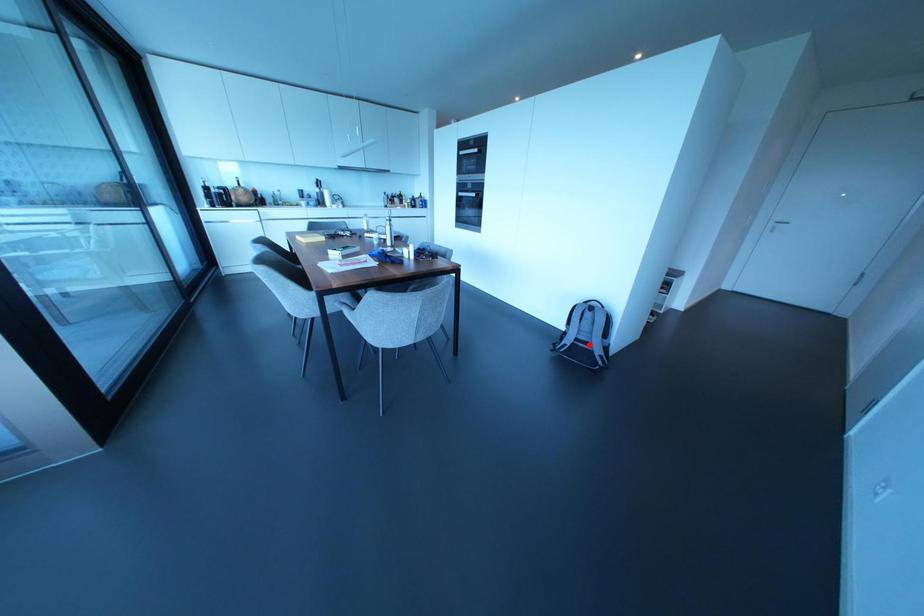
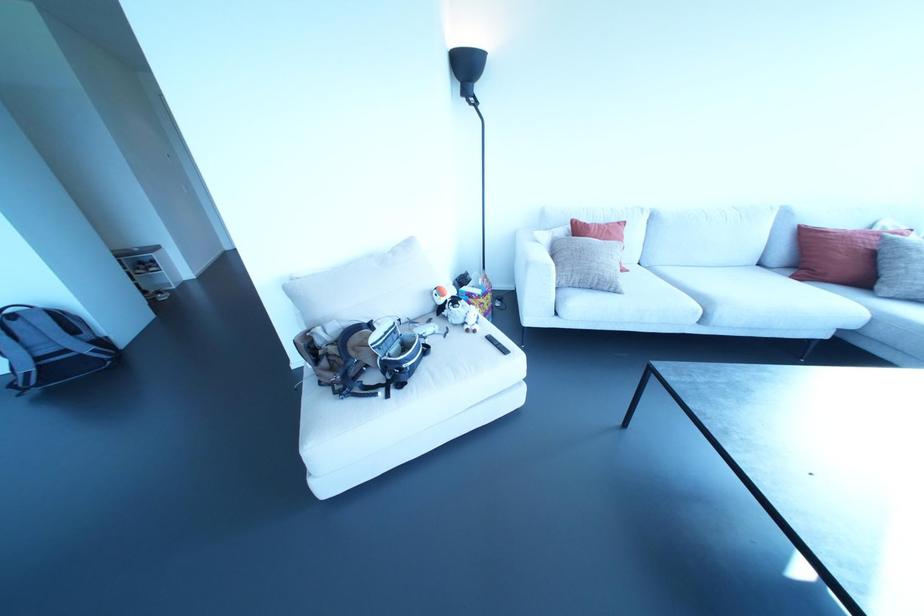
Question: I am providing you with two images of the same scene from different viewpoints. Image1 has a red point marked. In image2, the corresponding 3D location appears at what relative position? Reply with the corresponding letter.

Choices:
 (A) Closer
 (B) Farther

Answer: (B)